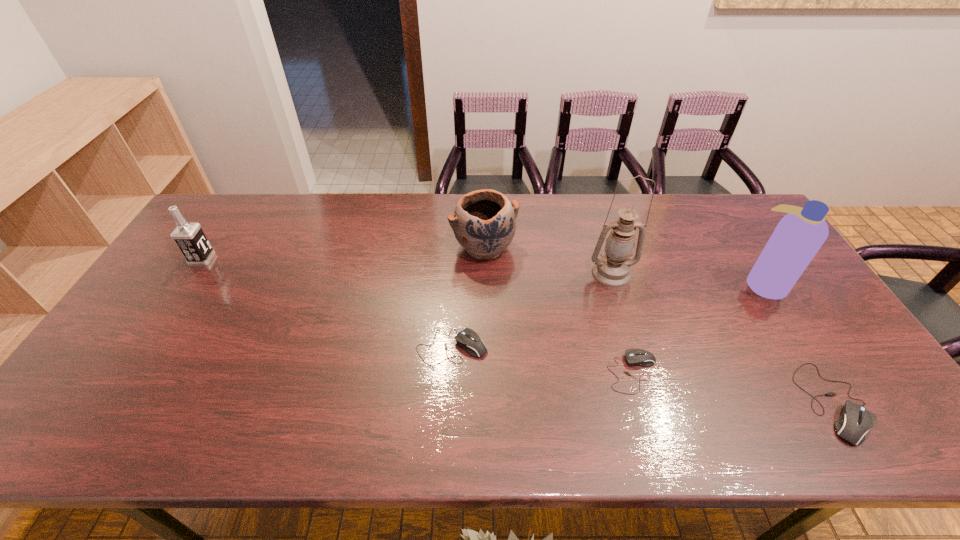
Find the location of a particular element. object situated at the near right corner is located at coordinates (855, 420).

Find the location of a particular element. The image size is (960, 540). free region at the far edge of the desktop is located at coordinates (542, 193).

At what (x,y) coordinates should I click in order to perform the action: click on vacant space at the near edge of the desktop. Please return your answer as a coordinate pair (x, y). This screenshot has width=960, height=540. Looking at the image, I should click on (396, 382).

I want to click on vacant space at the left edge of the desktop, so click(165, 353).

You are a GUI agent. You are given a task and a screenshot of the screen. Output one action in this format:
    pyautogui.click(x=<x>, y=<y>)
    Task: Click on the vacant region at the near left corner
    The width and height of the screenshot is (960, 540).
    Given the screenshot: What is the action you would take?
    pyautogui.click(x=84, y=388)

Find the location of a particular element. blank region between the sixth tallest object and the vodka is located at coordinates (327, 303).

Locate an element on the screen. The width and height of the screenshot is (960, 540). vacant space that is in between the shortest computer mouse and the vodka is located at coordinates (418, 316).

The width and height of the screenshot is (960, 540). In order to click on free spot between the vodka and the shortest computer mouse in this screenshot , I will do `click(418, 316)`.

Locate an element on the screen. This screenshot has height=540, width=960. empty space between the second tallest computer mouse and the shampoo is located at coordinates pos(608,315).

Where is `free space that is in between the second shortest computer mouse and the rightmost computer mouse`? free space that is in between the second shortest computer mouse and the rightmost computer mouse is located at coordinates (643, 374).